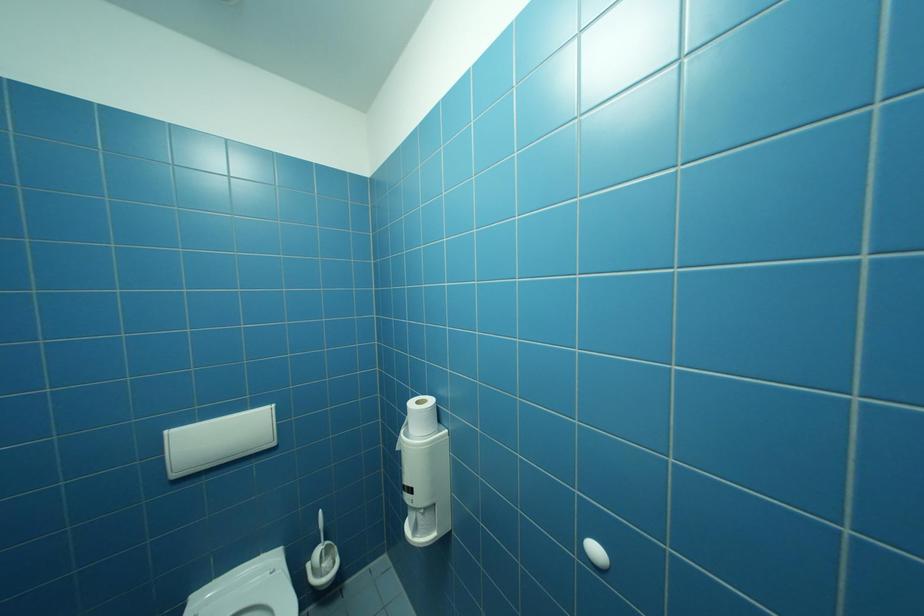
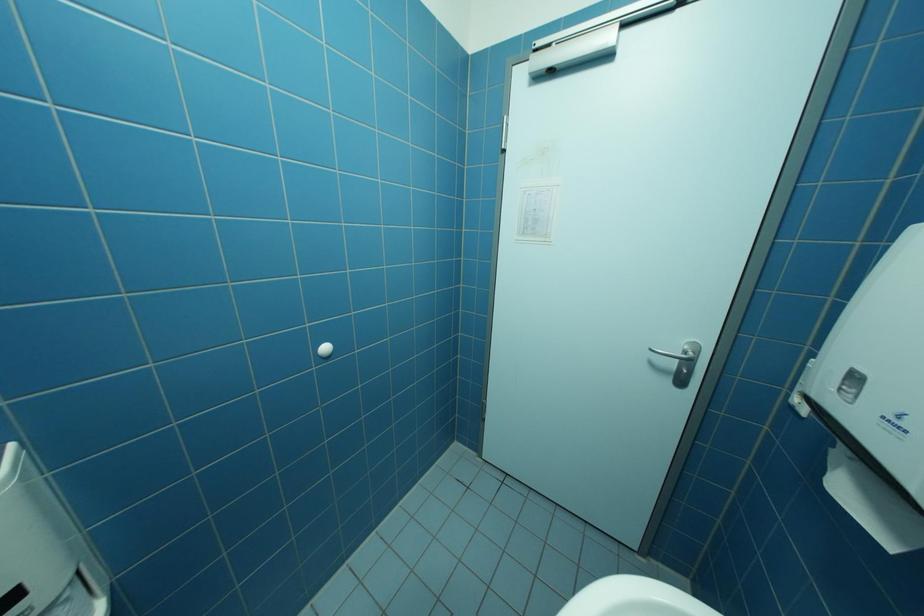
The first image is from the beginning of the video and the second image is from the end. How did the camera likely rotate when shooting the video?

The camera rotated toward right-down.